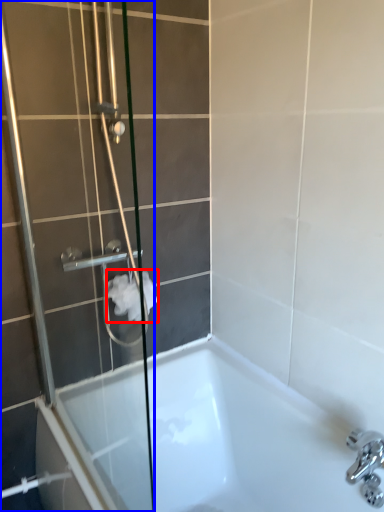
Question: Which object is further to the camera taking this photo, toilet paper (highlighted by a red box) or shower door (highlighted by a blue box)?

Choices:
 (A) toilet paper
 (B) shower door

Answer: (A)